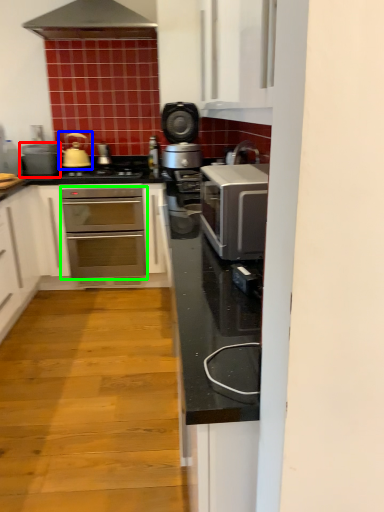
Question: Based on their relative distances, which object is farther from appliance (highlighted by a red box)? Choose from tea pot (highlighted by a blue box) and oven (highlighted by a green box).

Choices:
 (A) tea pot
 (B) oven

Answer: (B)